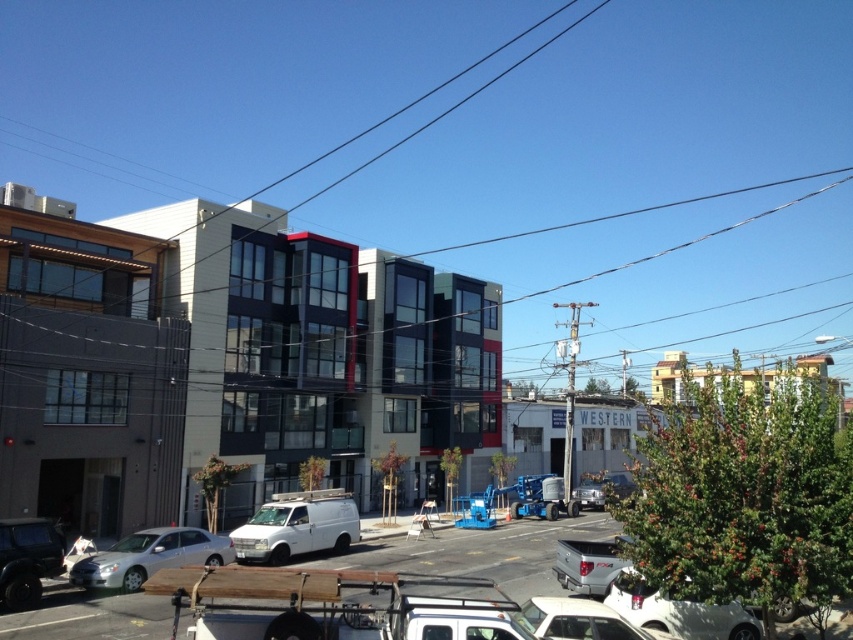
Question: Does white matte car at lower center have a lesser width compared to silver metallic truck at lower center?

Choices:
 (A) no
 (B) yes

Answer: (A)

Question: Which point is farther to the camera?

Choices:
 (A) (503, 614)
 (B) (641, 586)
 (C) (35, 532)

Answer: (C)

Question: In this image, where is silver metallic sedan at lower left located relative to matte black truck at lower left?

Choices:
 (A) left
 (B) right

Answer: (B)

Question: Which point is closer to the camera?

Choices:
 (A) white matte van at center
 (B) white matte car at lower center
 (C) silver metallic sedan at lower left
 (D) white matte car at lower right

Answer: (A)

Question: Where is matte black truck at lower left located in relation to matte silver suv at lower right in the image?

Choices:
 (A) below
 (B) above

Answer: (B)

Question: Which point is closer to the camera?

Choices:
 (A) white matte car at lower center
 (B) matte silver suv at lower right

Answer: (A)